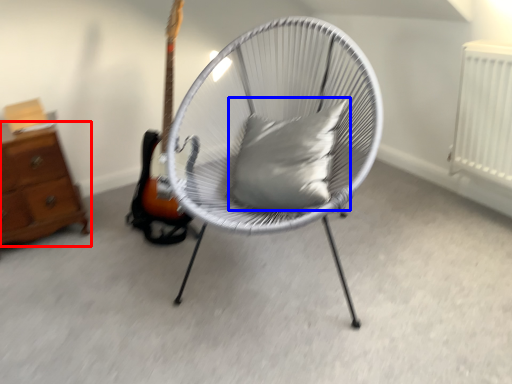
Question: Which point is further to the camera, chest of drawers (highlighted by a red box) or pillow (highlighted by a blue box)?

Choices:
 (A) chest of drawers
 (B) pillow

Answer: (A)